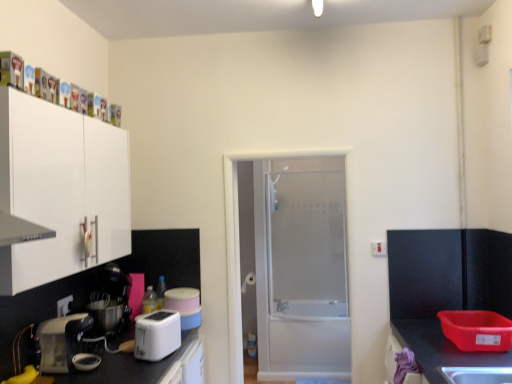
Question: Can you confirm if white plastic toaster at lower left, the 1th kitchen appliance in the left-to-right sequence, is positioned to the left of matte black mixer at lower left, the first appliance when ordered from left to right?

Choices:
 (A) no
 (B) yes

Answer: (B)

Question: From a real-world perspective, does white plastic toaster at lower left, which is the second kitchen appliance from right to left, stand above matte black mixer at lower left, placed as the second appliance when sorted from right to left?

Choices:
 (A) yes
 (B) no

Answer: (B)

Question: Does white plastic toaster at lower left, the 1th kitchen appliance in the left-to-right sequence, lie in front of matte black mixer at lower left, placed as the second appliance when sorted from right to left?

Choices:
 (A) yes
 (B) no

Answer: (A)

Question: Can you confirm if white plastic toaster at lower left, the 1th kitchen appliance in the left-to-right sequence, is thinner than matte black mixer at lower left, placed as the second appliance when sorted from right to left?

Choices:
 (A) yes
 (B) no

Answer: (B)

Question: Can you confirm if white plastic toaster at lower left, the 1th kitchen appliance in the left-to-right sequence, is wider than matte black mixer at lower left, placed as the second appliance when sorted from right to left?

Choices:
 (A) no
 (B) yes

Answer: (B)

Question: Is matte black mixer at lower left, the first appliance when ordered from left to right, inside white plastic toaster at lower left, which is the second kitchen appliance from right to left?

Choices:
 (A) no
 (B) yes

Answer: (A)

Question: From the image's perspective, is white plastic toaster at lower left, the first kitchen appliance viewed from the right, over white matte cabinet at upper left?

Choices:
 (A) yes
 (B) no

Answer: (B)

Question: Can you confirm if white plastic toaster at lower left, the first kitchen appliance viewed from the right, is wider than white matte cabinet at upper left?

Choices:
 (A) no
 (B) yes

Answer: (A)

Question: Is the position of white plastic toaster at lower left, which is the second kitchen appliance from left to right, less distant than that of white matte cabinet at upper left?

Choices:
 (A) no
 (B) yes

Answer: (A)

Question: Considering the relative sizes of white plastic toaster at lower left, the first kitchen appliance viewed from the right, and white matte cabinet at upper left in the image provided, is white plastic toaster at lower left, the first kitchen appliance viewed from the right, shorter than white matte cabinet at upper left?

Choices:
 (A) yes
 (B) no

Answer: (A)

Question: Does white plastic toaster at lower left, which is the second kitchen appliance from left to right, appear on the left side of white matte cabinet at upper left?

Choices:
 (A) no
 (B) yes

Answer: (A)

Question: Does white plastic toaster at lower left, which is the second kitchen appliance from left to right, contain white matte cabinet at upper left?

Choices:
 (A) yes
 (B) no

Answer: (B)

Question: Is white plastic electric outlet at upper right, the 1th electric outlet from the right, not near matte black mixer at lower left, placed as the second appliance when sorted from right to left?

Choices:
 (A) no
 (B) yes

Answer: (B)